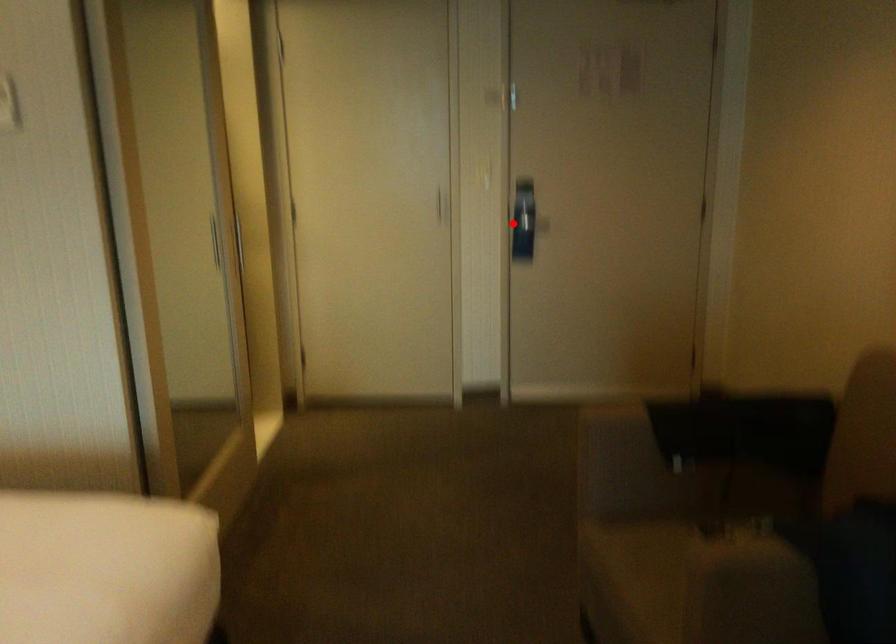
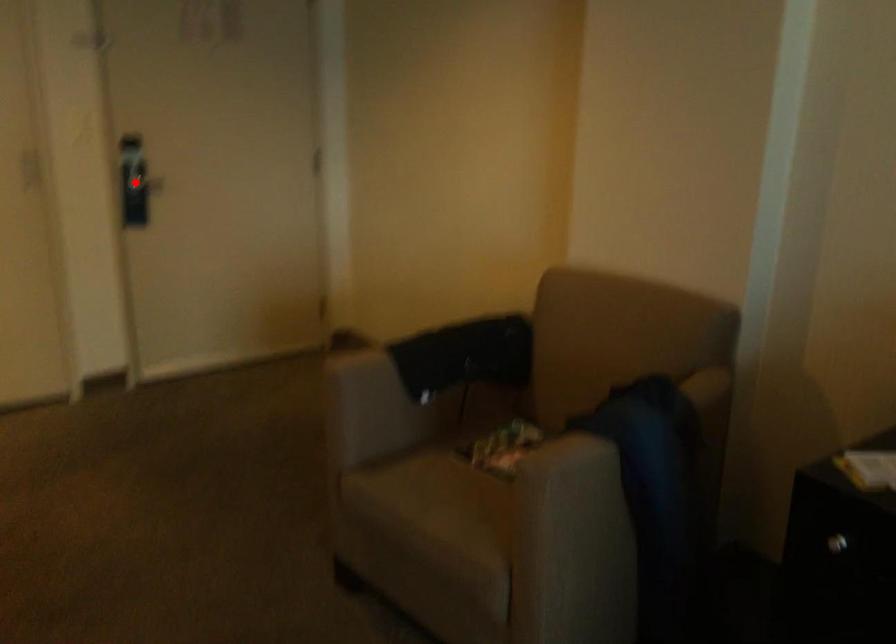
I am providing you with two images of the same scene from different viewpoints. A red point is marked on the first image and another point is marked on the second image. Do the highlighted points in image1 and image2 indicate the same real-world spot?

Yes